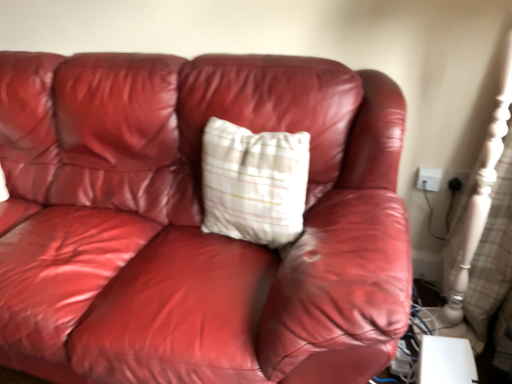
Question: Choose the correct answer: Is white plastic electric outlet at upper right, arranged as the 1th electric outlet when viewed from the left, inside plaid fabric pillow at center or outside it?

Choices:
 (A) outside
 (B) inside

Answer: (A)

Question: Considering the relative positions of white plastic electric outlet at upper right, arranged as the 1th electric outlet when viewed from the left, and plaid fabric pillow at center in the image provided, is white plastic electric outlet at upper right, arranged as the 1th electric outlet when viewed from the left, to the left or to the right of plaid fabric pillow at center?

Choices:
 (A) left
 (B) right

Answer: (B)

Question: Which object is the farthest from the plaid fabric pillow at center?

Choices:
 (A) black plastic outlet at upper right, the 2th electric outlet positioned from the left
 (B) white plastic electric outlet at upper right, which is counted as the 2th electric outlet, starting from the right

Answer: (A)

Question: Based on their relative distances, which object is nearer to the plaid fabric pillow at center?

Choices:
 (A) black plastic outlet at upper right, the 2th electric outlet positioned from the left
 (B) white plastic electric outlet at upper right, which is counted as the 2th electric outlet, starting from the right

Answer: (B)